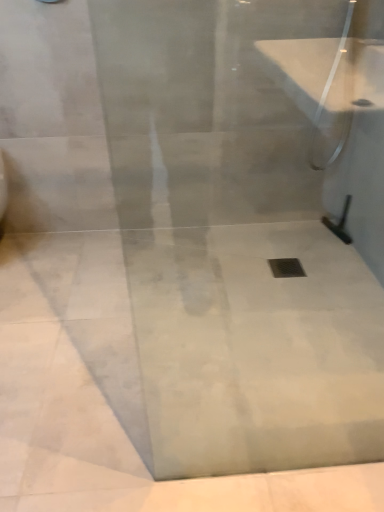
At what (x,y) coordinates should I click in order to perform the action: click on vacant space that is to the left of black rubber squeegee at right, which is the first shower in bottom-to-top order. Please return your answer as a coordinate pair (x, y). Image resolution: width=384 pixels, height=512 pixels. Looking at the image, I should click on (310, 233).